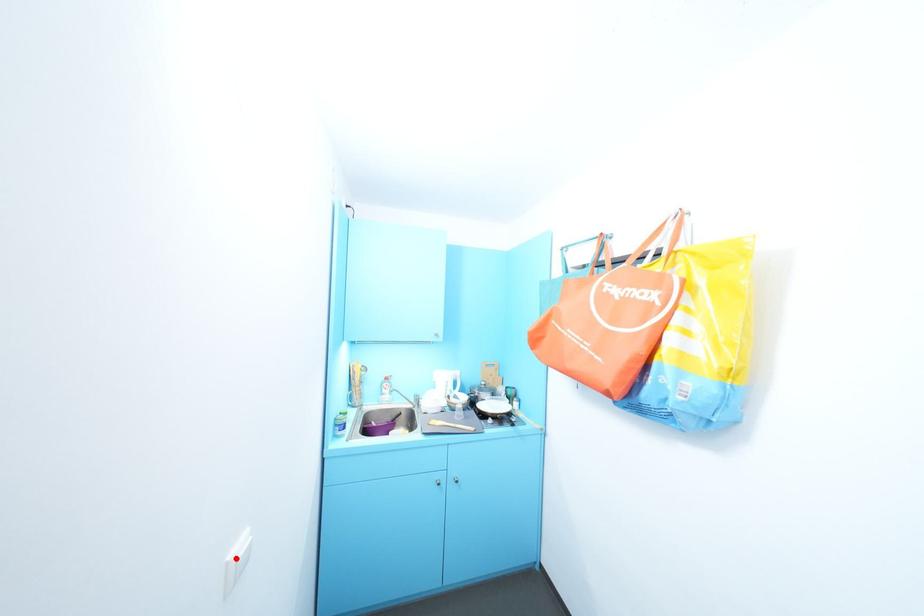
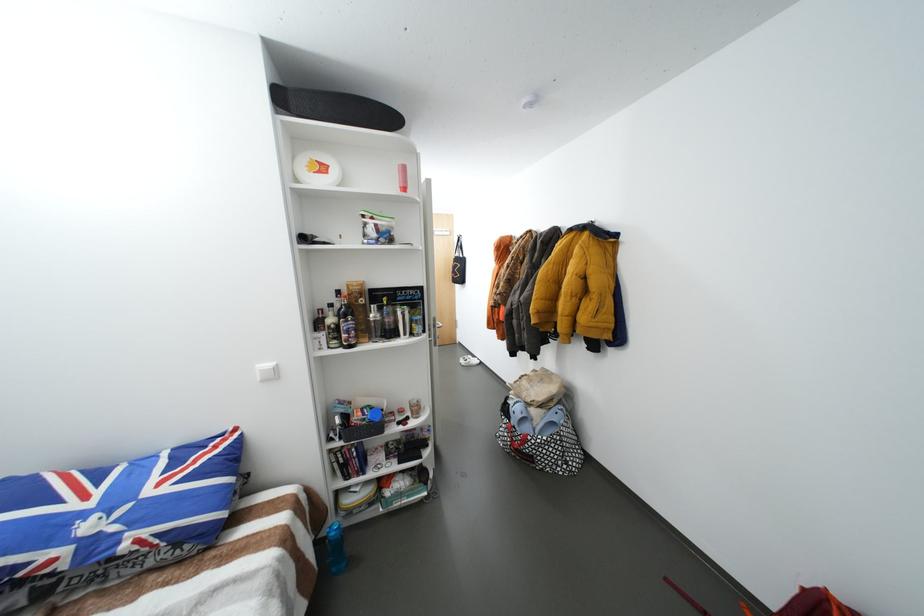
Question: I am providing you with two images of the same scene from different viewpoints. A red point is marked on the first image. Is the red point's position out of view in image 2?

Choices:
 (A) Yes
 (B) No

Answer: (A)